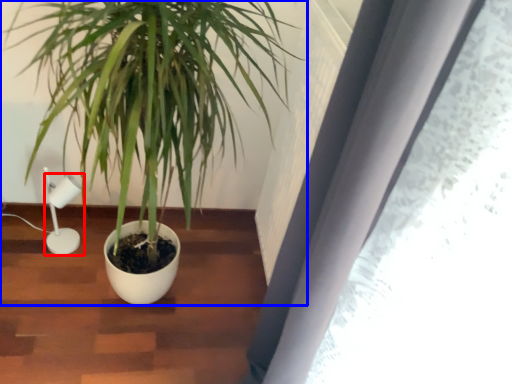
Question: Which of the following is the farthest to the observer, lamp (highlighted by a red box) or houseplant (highlighted by a blue box)?

Choices:
 (A) lamp
 (B) houseplant

Answer: (A)